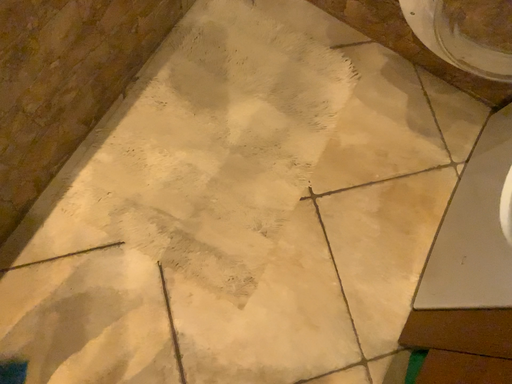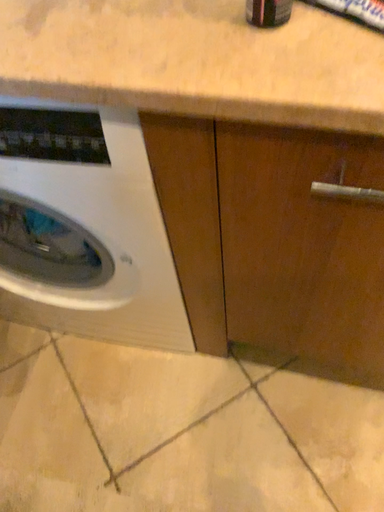
Question: How did the camera likely rotate when shooting the video?

Choices:
 (A) rotated right
 (B) rotated left

Answer: (A)